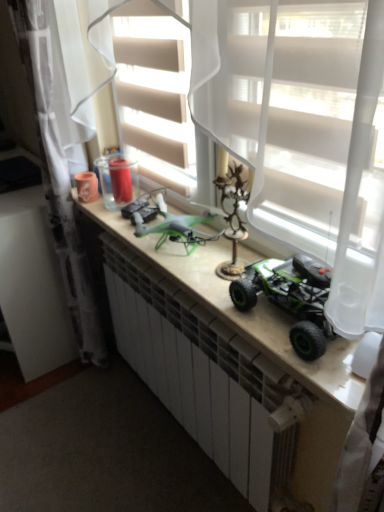
Question: Is white sheer curtain at center, the second curtain from the left, shorter than matte white counter at center?

Choices:
 (A) yes
 (B) no

Answer: (B)

Question: From a real-world perspective, does white sheer curtain at center, positioned as the 1th curtain in right-to-left order, stand above matte white counter at center?

Choices:
 (A) no
 (B) yes

Answer: (B)

Question: Is white sheer curtain at center, positioned as the 1th curtain in right-to-left order, to the right of matte white counter at center from the viewer's perspective?

Choices:
 (A) yes
 (B) no

Answer: (A)

Question: Can you confirm if white sheer curtain at center, the second curtain from the left, is smaller than matte white counter at center?

Choices:
 (A) no
 (B) yes

Answer: (B)

Question: Is white sheer curtain at center, positioned as the 1th curtain in right-to-left order, taller than matte white counter at center?

Choices:
 (A) yes
 (B) no

Answer: (A)

Question: From the image's perspective, is white sheer curtain at upper left, which is the first curtain in left-to-right order, positioned above or below matte white counter at center?

Choices:
 (A) below
 (B) above

Answer: (B)

Question: Is point (44, 122) closer or farther from the camera than point (238, 326)?

Choices:
 (A) farther
 (B) closer

Answer: (A)

Question: Is white sheer curtain at upper left, which is the first curtain in left-to-right order, bigger or smaller than matte white counter at center?

Choices:
 (A) small
 (B) big

Answer: (B)

Question: In terms of width, does white sheer curtain at upper left, which is the first curtain in left-to-right order, look wider or thinner when compared to matte white counter at center?

Choices:
 (A) thin
 (B) wide

Answer: (B)

Question: Looking at the image, does white sheer curtain at upper left, which is the first curtain in left-to-right order, seem bigger or smaller compared to white sheer curtain at center, positioned as the 1th curtain in right-to-left order?

Choices:
 (A) big
 (B) small

Answer: (A)

Question: Considering the relative positions of white sheer curtain at upper left, which is the first curtain in left-to-right order, and white sheer curtain at center, the second curtain from the left, in the image provided, is white sheer curtain at upper left, which is the first curtain in left-to-right order, to the left or to the right of white sheer curtain at center, the second curtain from the left,?

Choices:
 (A) left
 (B) right

Answer: (A)

Question: Considering the positions of point (44, 34) and point (248, 80), is point (44, 34) closer or farther from the camera than point (248, 80)?

Choices:
 (A) farther
 (B) closer

Answer: (A)

Question: In the image, is white sheer curtain at upper left, which is the first curtain in left-to-right order, positioned in front of or behind white sheer curtain at center, the second curtain from the left?

Choices:
 (A) front
 (B) behind

Answer: (B)

Question: Relative to white sheer curtain at upper left, which is the first curtain in left-to-right order, is matte white counter at center in front or behind?

Choices:
 (A) behind
 (B) front

Answer: (B)

Question: Is matte white counter at center wider or thinner than white sheer curtain at upper left, marked as the 2th curtain in a right-to-left arrangement?

Choices:
 (A) wide
 (B) thin

Answer: (B)